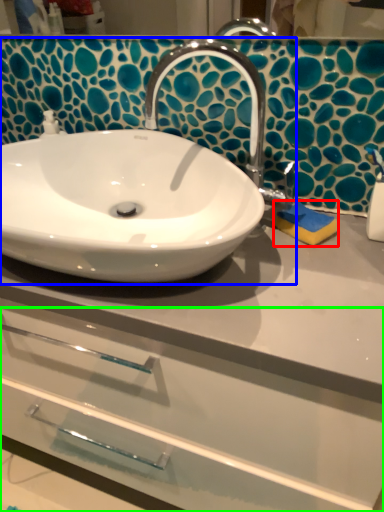
Question: Which object is positioned farthest from soap (highlighted by a red box)? Select from sink (highlighted by a blue box) and drawer (highlighted by a green box).

Choices:
 (A) sink
 (B) drawer

Answer: (B)